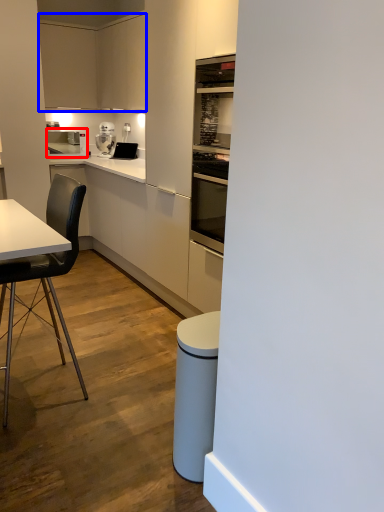
Question: Which of the following is the farthest to the observer, kitchen appliance (highlighted by a red box) or cabinetry (highlighted by a blue box)?

Choices:
 (A) kitchen appliance
 (B) cabinetry

Answer: (A)